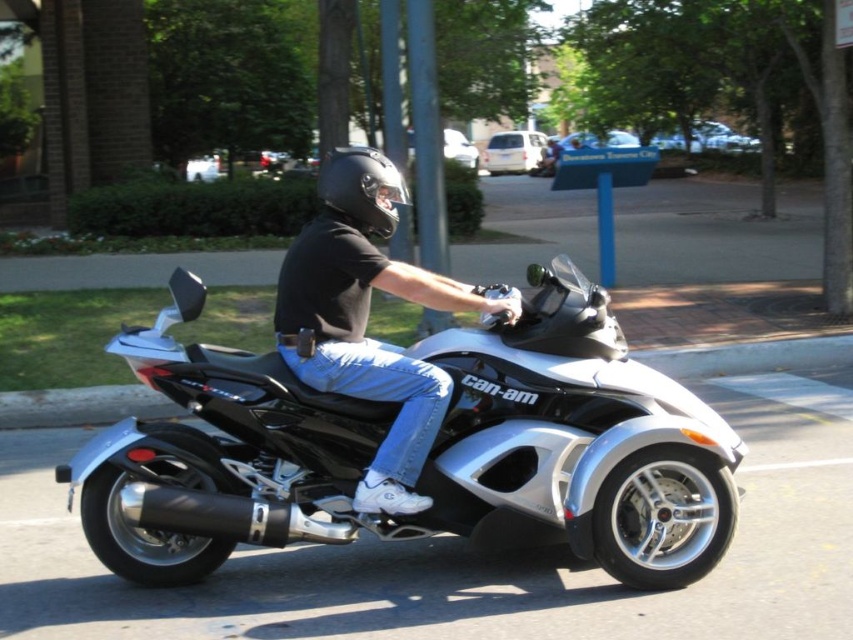
Who is higher up, silver metallic trike at center or black matte helmet at center?

black matte helmet at center is above.

Does silver metallic trike at center have a larger size compared to black matte helmet at center?

Yes, silver metallic trike at center is bigger than black matte helmet at center.

Who is more distant from viewer, (120, 499) or (355, 196)?

The point (355, 196) is more distant.

Locate an element on the screen. Image resolution: width=853 pixels, height=640 pixels. silver metallic trike at center is located at coordinates coord(428,454).

Who is more distant from viewer, (397, 400) or (341, 204)?

Positioned behind is point (341, 204).

Describe the element at coordinates (367, 317) in the screenshot. Image resolution: width=853 pixels, height=640 pixels. I see `matte black helmet at upper center` at that location.

Image resolution: width=853 pixels, height=640 pixels. I want to click on matte black helmet at upper center, so click(x=367, y=317).

Looking at this image, does silver metallic trike at center come behind matte black helmet at upper center?

No, it is not.

Can you confirm if silver metallic trike at center is taller than matte black helmet at upper center?

No.

You are a GUI agent. You are given a task and a screenshot of the screen. Output one action in this format:
    pyautogui.click(x=<x>, y=<y>)
    Task: Click on the silver metallic trike at center
    This screenshot has width=853, height=640.
    Given the screenshot: What is the action you would take?
    pyautogui.click(x=428, y=454)

Where is `silver metallic trike at center`? The image size is (853, 640). silver metallic trike at center is located at coordinates (428, 454).